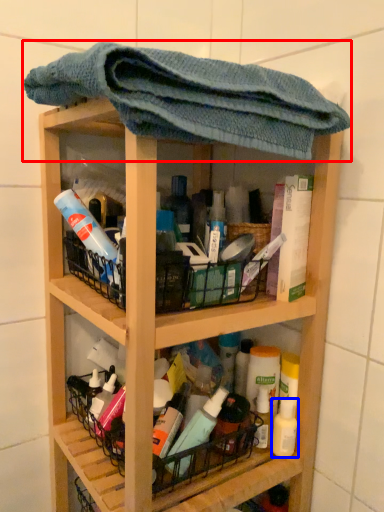
Question: Which object is closer to the camera taking this photo, towel (highlighted by a red box) or mouthwash (highlighted by a blue box)?

Choices:
 (A) towel
 (B) mouthwash

Answer: (A)